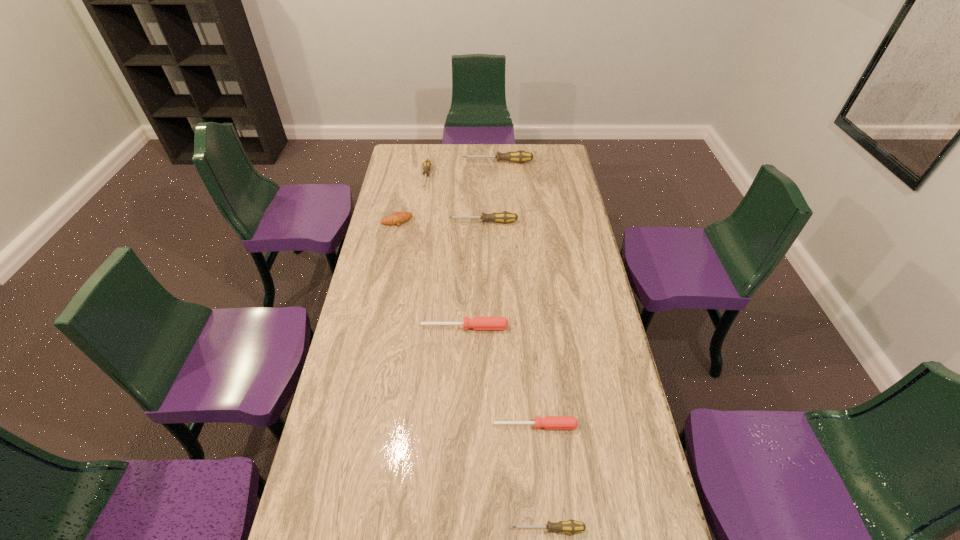
Identify the location of vacant space at the right edge. Image resolution: width=960 pixels, height=540 pixels. (584, 227).

In the image, there is a desktop. Identify the location of vacant space at the far left corner. (398, 145).

Identify the location of blank space at the far right corner. (548, 167).

The image size is (960, 540). In order to click on free space that is in between the third farthest screwdriver and the third nearest screwdriver in this screenshot , I will do (x=474, y=275).

This screenshot has width=960, height=540. I want to click on free space between the fifth shortest screwdriver and the biggest gray screwdriver, so click(491, 192).

Locate an element on the screen. The width and height of the screenshot is (960, 540). free point between the fifth shortest screwdriver and the farther red screwdriver is located at coordinates click(474, 275).

The width and height of the screenshot is (960, 540). I want to click on free spot between the leftmost object and the third nearest object, so click(431, 274).

What are the coordinates of `free spot between the crescent roll and the farther red screwdriver` in the screenshot? It's located at (431, 274).

Choose which object is the third nearest neighbor to the third nearest screwdriver. Please provide its 2D coordinates. Your answer should be formatted as a tuple, i.e. [(x, y)], where the tuple contains the x and y coordinates of a point satisfying the conditions above.

[(504, 217)]

Choose which object is the nearest neighbor to the tallest screwdriver. Please provide its 2D coordinates. Your answer should be formatted as a tuple, i.e. [(x, y)], where the tuple contains the x and y coordinates of a point satisfying the conditions above.

[(427, 163)]